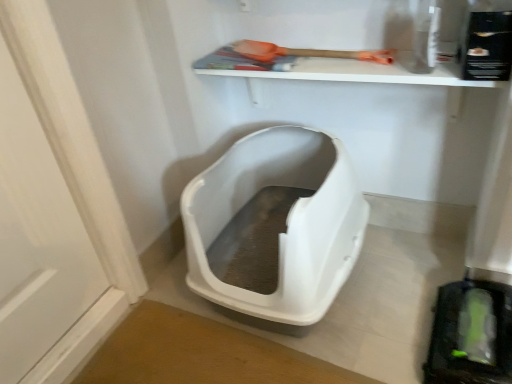
Question: Does white plastic litter box at center have a lesser width compared to orange plastic shovel at upper center?

Choices:
 (A) yes
 (B) no

Answer: (B)

Question: Is white plastic litter box at center behind orange plastic shovel at upper center?

Choices:
 (A) yes
 (B) no

Answer: (B)

Question: Is orange plastic shovel at upper center at the back of white plastic litter box at center?

Choices:
 (A) yes
 (B) no

Answer: (B)

Question: Can we say white plastic litter box at center lies outside orange plastic shovel at upper center?

Choices:
 (A) no
 (B) yes

Answer: (B)

Question: Can you confirm if white plastic litter box at center is wider than orange plastic shovel at upper center?

Choices:
 (A) no
 (B) yes

Answer: (B)

Question: Considering the relative sizes of white plastic litter box at center and orange plastic shovel at upper center in the image provided, is white plastic litter box at center shorter than orange plastic shovel at upper center?

Choices:
 (A) no
 (B) yes

Answer: (A)

Question: From a real-world perspective, is orange plastic shovel at upper center located beneath white plastic litter box at center?

Choices:
 (A) yes
 (B) no

Answer: (B)

Question: Could you tell me if orange plastic shovel at upper center is facing white plastic litter box at center?

Choices:
 (A) no
 (B) yes

Answer: (A)

Question: From the image's perspective, does orange plastic shovel at upper center appear higher than white plastic litter box at center?

Choices:
 (A) no
 (B) yes

Answer: (B)

Question: Does orange plastic shovel at upper center have a lesser height compared to white plastic litter box at center?

Choices:
 (A) yes
 (B) no

Answer: (A)

Question: Can you confirm if orange plastic shovel at upper center is positioned to the right of white plastic litter box at center?

Choices:
 (A) no
 (B) yes

Answer: (B)

Question: Is orange plastic shovel at upper center facing away from white plastic litter box at center?

Choices:
 (A) yes
 (B) no

Answer: (B)

Question: In terms of height, does orange plastic shovel at upper center look taller or shorter compared to white plastic litter box at center?

Choices:
 (A) tall
 (B) short

Answer: (B)